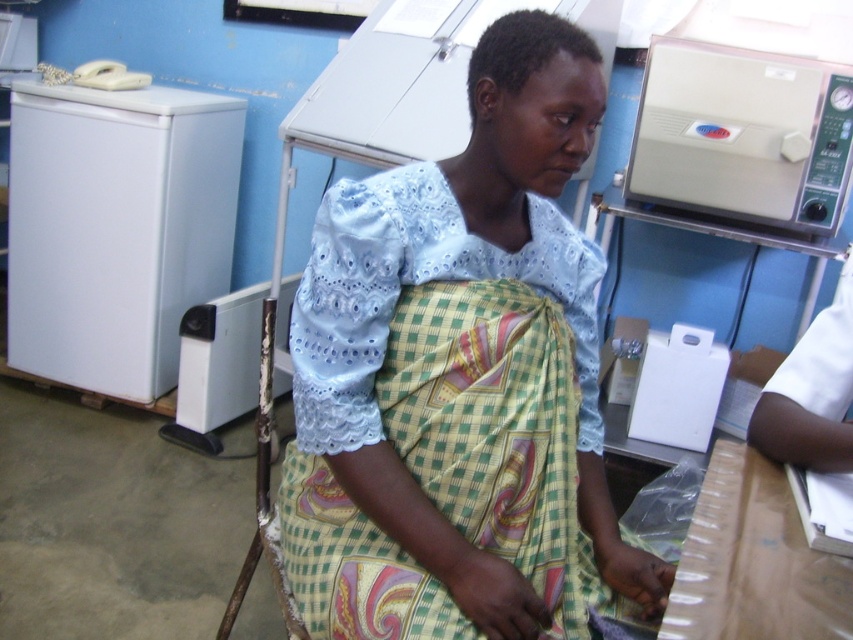
Question: Which of the following is the closest to the observer?

Choices:
 (A) beige plastic sterilizer at upper right
 (B) light blue lace blouse at center
 (C) white matte refrigerator at left

Answer: (B)

Question: Considering the real-world distances, which object is farthest from the beige plastic sterilizer at upper right?

Choices:
 (A) white matte refrigerator at left
 (B) light blue lace blouse at center

Answer: (A)

Question: Which object is closer to the camera taking this photo?

Choices:
 (A) light blue lace blouse at center
 (B) white matte refrigerator at left

Answer: (A)

Question: Where is white matte refrigerator at left located in relation to beige plastic sterilizer at upper right in the image?

Choices:
 (A) left
 (B) right

Answer: (A)

Question: Can you confirm if white matte refrigerator at left is positioned to the left of beige plastic sterilizer at upper right?

Choices:
 (A) yes
 (B) no

Answer: (A)

Question: Is light blue lace blouse at center to the right of beige plastic sterilizer at upper right from the viewer's perspective?

Choices:
 (A) yes
 (B) no

Answer: (B)